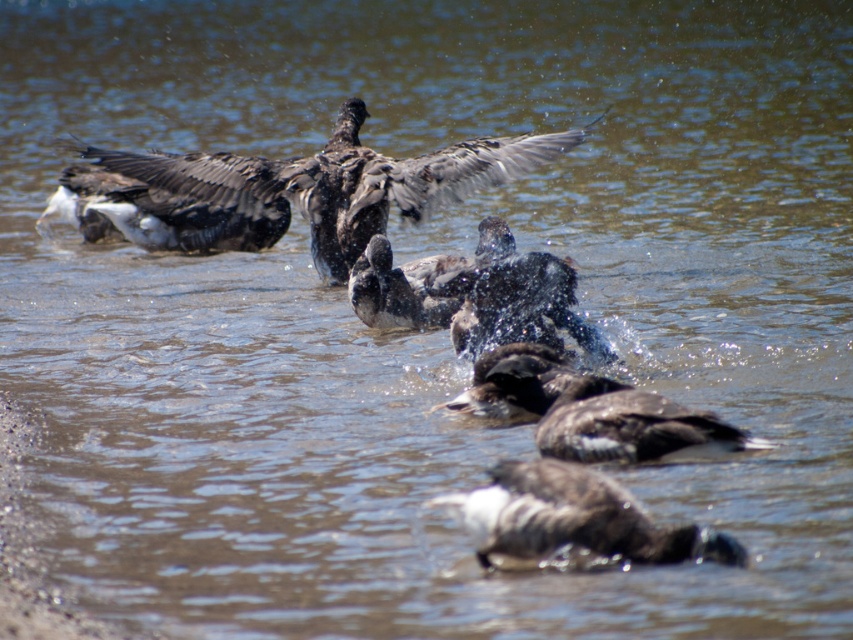
You are observing a group of ducks in a pond. You notice two sets of feathers in the water. One is dark gray feathers at center and the other is dark brown feathers at lower center. Which set of feathers appears to be wider?

The dark gray feathers at center might be wider than dark brown feathers at lower center according to the description.

You are a wildlife photographer trying to capture a closeup of the dark brown feathers at center and dark brown feathers at lower center in the image. Your camera has a zoom lens that can focus on objects within a 1.5 meter range. Can you capture both sets of feathers in a single focused shot?

The dark brown feathers at center and dark brown feathers at lower center are 1.39 meters apart, so yes, the camera can focus on both since the distance between them is within the 1.5 meter range.

You are a birdwatcher observing ducks in a pond. You notice a point in the center of the water with coordinates approximately (317,186). What do you see at that location?

At point (317,186), there are dark gray feathers at center.